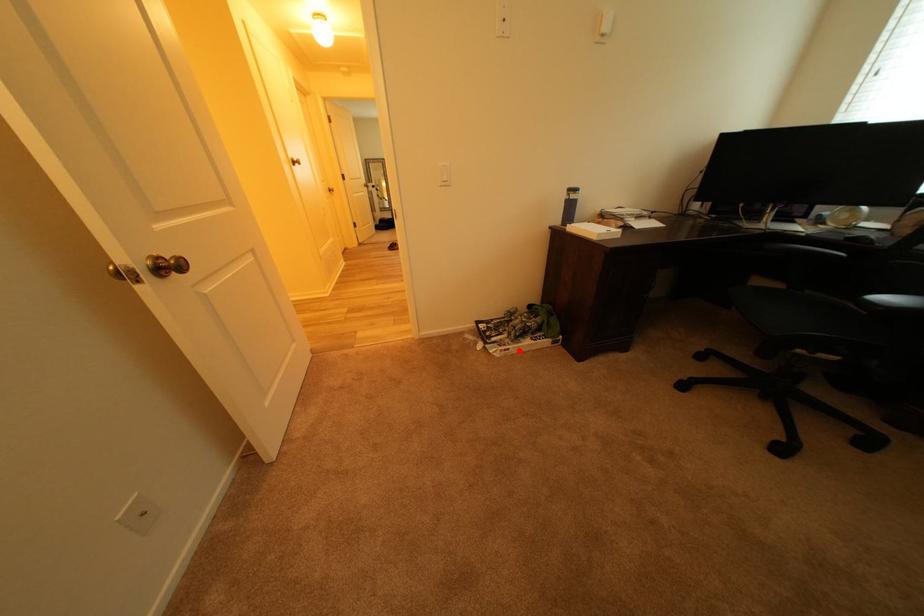
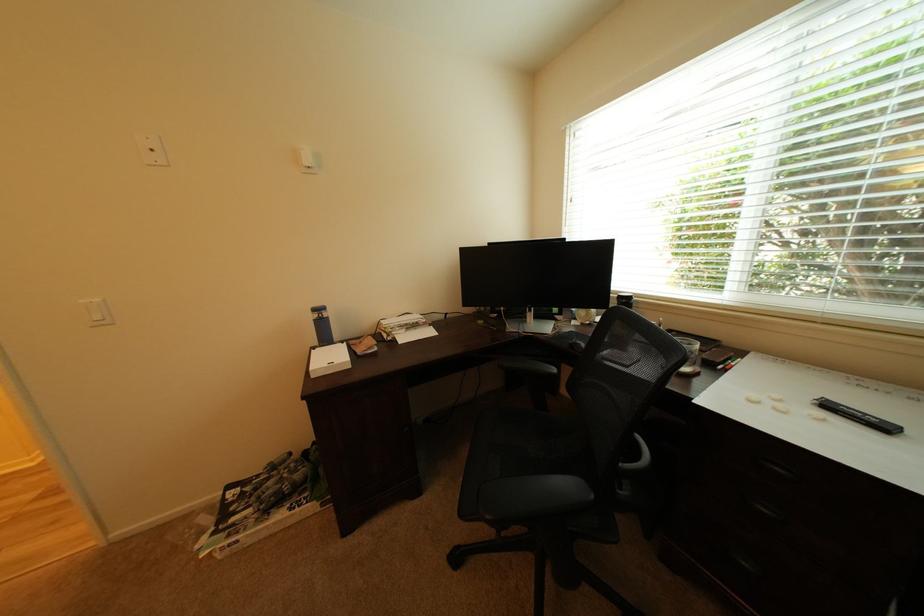
In the second image, find the point that corresponds to the highlighted location in the first image.

(248, 543)